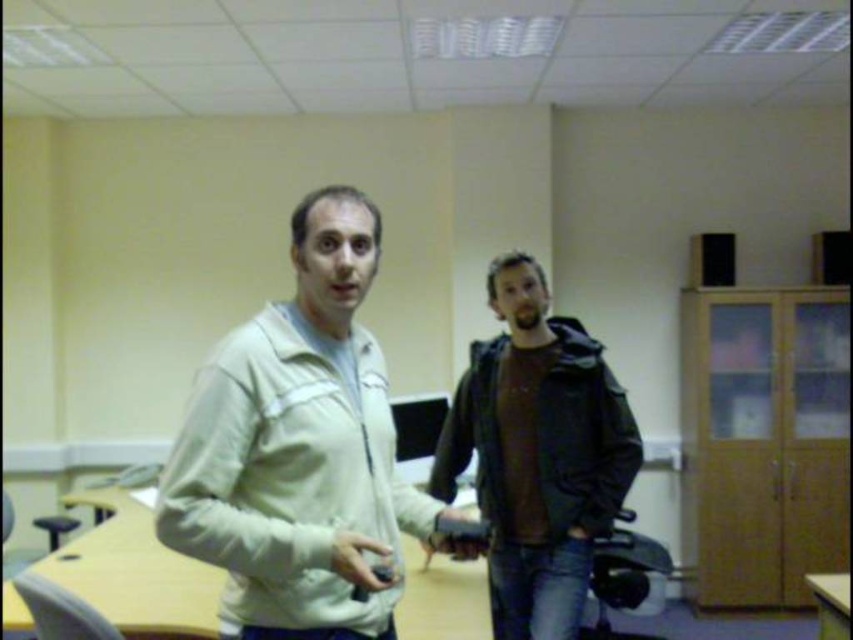
Is light beige jacket at center wider than dark brown leather jacket at center?

In fact, light beige jacket at center might be narrower than dark brown leather jacket at center.

Can you confirm if light beige jacket at center is bigger than dark brown leather jacket at center?

No.

Who is more distant from viewer, (386, 630) or (572, 444)?

Point (572, 444)

Locate an element on the screen. This screenshot has height=640, width=853. light beige jacket at center is located at coordinates (299, 449).